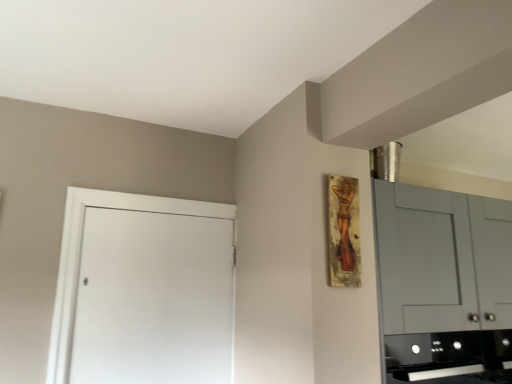
Describe the element at coordinates (143, 290) in the screenshot. I see `white matte door at left` at that location.

In order to click on black glossy oven at lower right in this screenshot , I will do `click(450, 356)`.

Identify the location of wooden painting at upper right. (343, 232).

Does black glossy oven at lower right appear on the right side of wooden painting at upper right?

Indeed, black glossy oven at lower right is positioned on the right side of wooden painting at upper right.

Looking at their sizes, would you say black glossy oven at lower right is wider or thinner than wooden painting at upper right?

Clearly, black glossy oven at lower right has more width compared to wooden painting at upper right.

From a real-world perspective, is black glossy oven at lower right physically located above or below wooden painting at upper right?

black glossy oven at lower right is below wooden painting at upper right.

In terms of size, does white matte door at left appear bigger or smaller than wooden painting at upper right?

white matte door at left is bigger than wooden painting at upper right.

Based on the photo, from the image's perspective, would you say white matte door at left is positioned over wooden painting at upper right?

No, from the image's perspective, white matte door at left is not over wooden painting at upper right.

How many degrees apart are the facing directions of white matte door at left and wooden painting at upper right?

The facing directions of white matte door at left and wooden painting at upper right are 3.24 degrees apart.

How much distance is there between white matte door at left and wooden painting at upper right?

white matte door at left and wooden painting at upper right are 36.34 inches apart.

From the image's perspective, is white matte door at left under black glossy oven at lower right?

No, from the image's perspective, white matte door at left is not beneath black glossy oven at lower right.

Is white matte door at left positioned before black glossy oven at lower right?

Yes, it is in front of black glossy oven at lower right.

Considering the sizes of objects white matte door at left and black glossy oven at lower right in the image provided, who is smaller, white matte door at left or black glossy oven at lower right?

Smaller between the two is white matte door at left.

Locate an element on the screen. The height and width of the screenshot is (384, 512). door located in front of the black glossy oven at lower right is located at coordinates 143,290.

Is wooden painting at upper right directly adjacent to black glossy oven at lower right?

No.

Is wooden painting at upper right aimed at black glossy oven at lower right?

No, wooden painting at upper right is not oriented towards black glossy oven at lower right.

Can black glossy oven at lower right be found inside wooden painting at upper right?

Definitely not — black glossy oven at lower right is not inside wooden painting at upper right.

This screenshot has height=384, width=512. In order to click on appliance lying behind the white matte door at left in this screenshot , I will do `click(450, 356)`.

Is black glossy oven at lower right surrounding white matte door at left?

No, white matte door at left is not inside black glossy oven at lower right.

Looking at their sizes, would you say black glossy oven at lower right is wider or thinner than white matte door at left?

Clearly, black glossy oven at lower right has more width compared to white matte door at left.

Is point (341, 225) less distant than point (135, 305)?

Yes, point (341, 225) is closer to viewer.

Is wooden painting at upper right positioned beyond the bounds of white matte door at left?

Yes, wooden painting at upper right is outside of white matte door at left.

How much distance is there between wooden painting at upper right and white matte door at left?

92.29 centimeters.

From a real-world perspective, does wooden painting at upper right sit lower than white matte door at left?

No, from a real-world perspective, wooden painting at upper right is not under white matte door at left.

Where is `picture frame on the left of the black glossy oven at lower right`? Image resolution: width=512 pixels, height=384 pixels. picture frame on the left of the black glossy oven at lower right is located at coordinates (343, 232).

Find the location of `door behind the wooden painting at upper right`. door behind the wooden painting at upper right is located at coordinates (143, 290).

From the image, which object appears to be farther from white matte door at left, black glossy oven at lower right or wooden painting at upper right?

black glossy oven at lower right is further to white matte door at left.

Looking at the image, which one is located closer to wooden painting at upper right, white matte door at left or black glossy oven at lower right?

black glossy oven at lower right.

Based on the photo, from the image, which object appears to be farther from wooden painting at upper right, black glossy oven at lower right or white matte door at left?

white matte door at left is positioned further to the anchor wooden painting at upper right.

From the image, which object appears to be nearer to black glossy oven at lower right, white matte door at left or wooden painting at upper right?

wooden painting at upper right is positioned closer to the anchor black glossy oven at lower right.

Which object lies nearer to the anchor point black glossy oven at lower right, wooden painting at upper right or white matte door at left?

wooden painting at upper right is positioned closer to the anchor black glossy oven at lower right.

Based on their spatial positions, is wooden painting at upper right or black glossy oven at lower right further from white matte door at left?

Based on the image, black glossy oven at lower right appears to be further to white matte door at left.

Identify the location of picture frame situated between white matte door at left and black glossy oven at lower right from left to right. The width and height of the screenshot is (512, 384). 343,232.